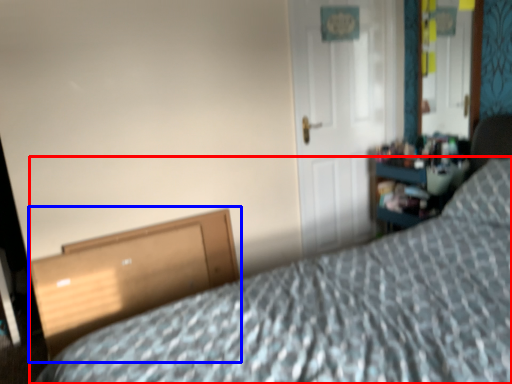
Question: Which object is further to the camera taking this photo, bed (highlighted by a red box) or file cabinet (highlighted by a blue box)?

Choices:
 (A) bed
 (B) file cabinet

Answer: (B)